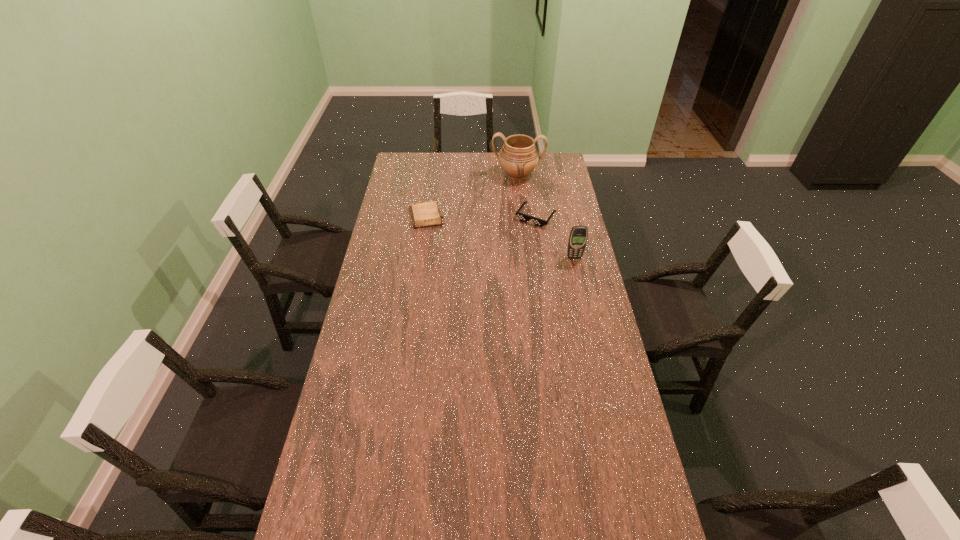
Locate an element on the screen. free space on the desktop that is between the leftmost object and the second tallest object and is positioned on the front-facing side of the farthest object is located at coordinates (512, 240).

Find the location of `free space on the desktop that is between the diary and the nearest object and is positioned on the front-facing side of the sunglasses`. free space on the desktop that is between the diary and the nearest object and is positioned on the front-facing side of the sunglasses is located at coordinates (517, 242).